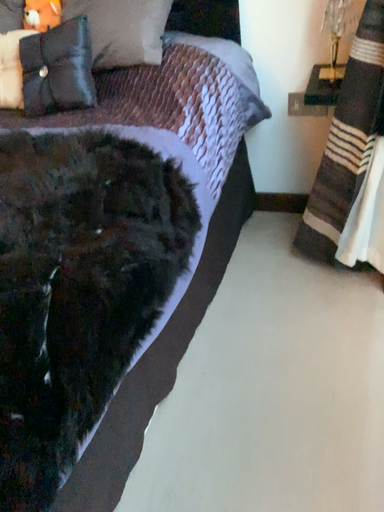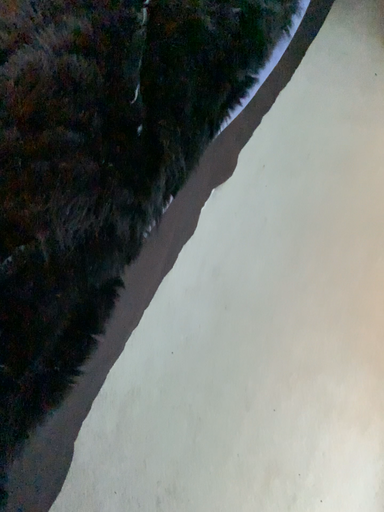
Question: Which way did the camera rotate in the video?

Choices:
 (A) rotated downward
 (B) rotated upward

Answer: (A)